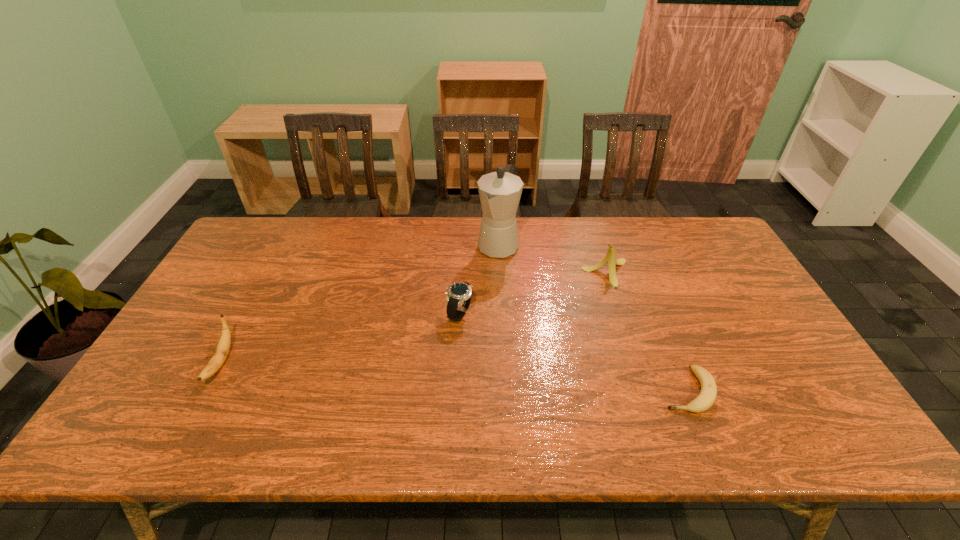
Identify the location of vacant space at the right edge of the desktop. This screenshot has width=960, height=540. (768, 401).

In the image, there is a desktop. Where is `vacant space at the far right corner`? The width and height of the screenshot is (960, 540). vacant space at the far right corner is located at coordinates [x=716, y=253].

Image resolution: width=960 pixels, height=540 pixels. In the image, there is a desktop. What are the coordinates of `vacant space at the near right corner` in the screenshot? It's located at (827, 415).

The height and width of the screenshot is (540, 960). In order to click on free space between the fourth object from right to left and the farthest banana in this screenshot , I will do `click(533, 293)`.

Locate an element on the screen. This screenshot has width=960, height=540. free spot between the tallest banana and the third object from left to right is located at coordinates (552, 259).

The height and width of the screenshot is (540, 960). What are the coordinates of `free space between the second tallest banana and the third farthest object` in the screenshot? It's located at (341, 338).

Locate an element on the screen. vacant space that is in between the second tallest object and the second shortest banana is located at coordinates (414, 318).

Identify the location of empty space between the farthest banana and the coffeepot. This screenshot has height=540, width=960. (552, 259).

Identify the location of free point between the leftmost object and the tallest object. (359, 303).

You are a GUI agent. You are given a task and a screenshot of the screen. Output one action in this format:
    pyautogui.click(x=<x>, y=<y>)
    Task: Click on the free spot between the second tallest object and the leftmost object
    
    Given the screenshot: What is the action you would take?
    pyautogui.click(x=414, y=318)